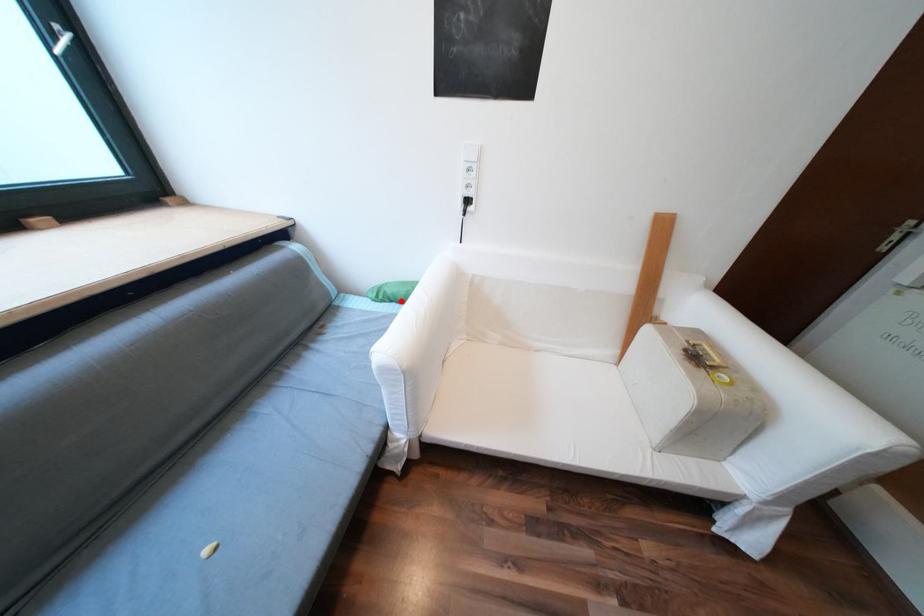
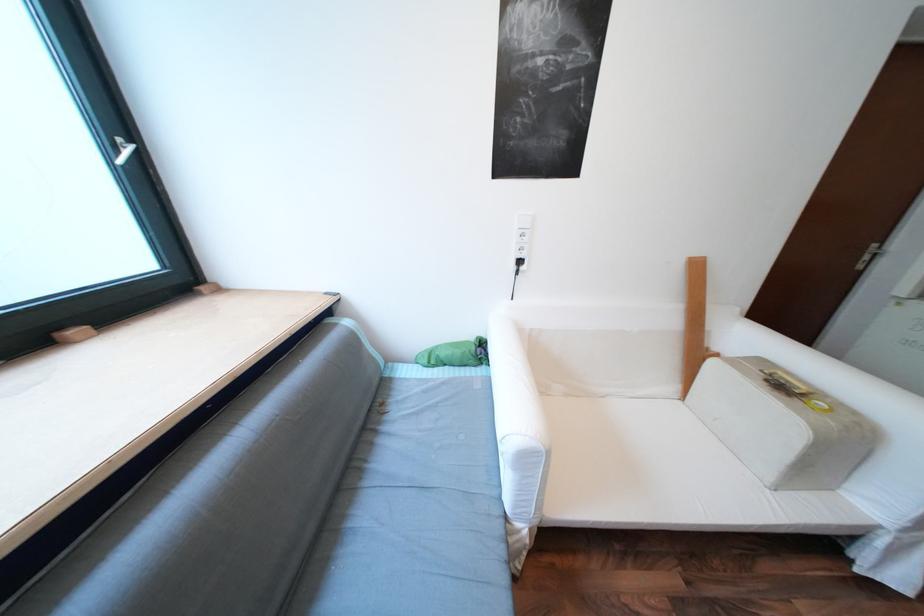
Locate, in the second image, the point that corresponds to the highlighted location in the first image.

(455, 365)